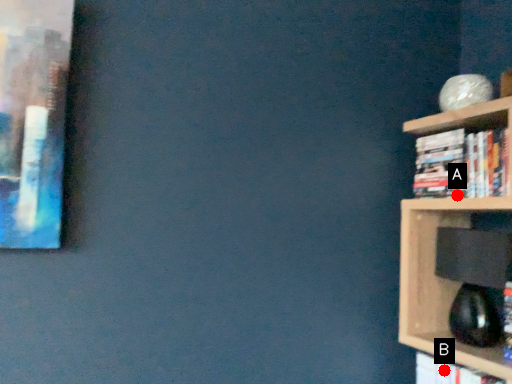
Question: Two points are circled on the image, labeled by A and B beside each circle. Which point is closer to the camera taking this photo?

Choices:
 (A) A is closer
 (B) B is closer

Answer: (A)